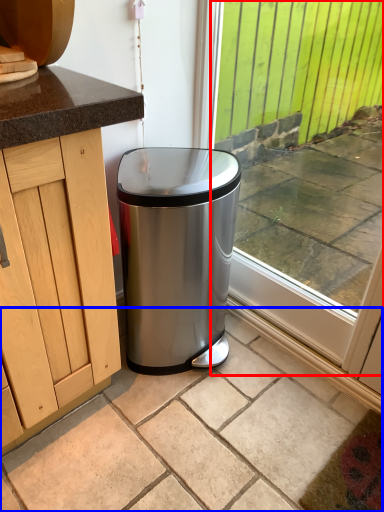
Question: Which object is further to the camera taking this photo, window (highlighted by a red box) or granite (highlighted by a blue box)?

Choices:
 (A) window
 (B) granite

Answer: (A)